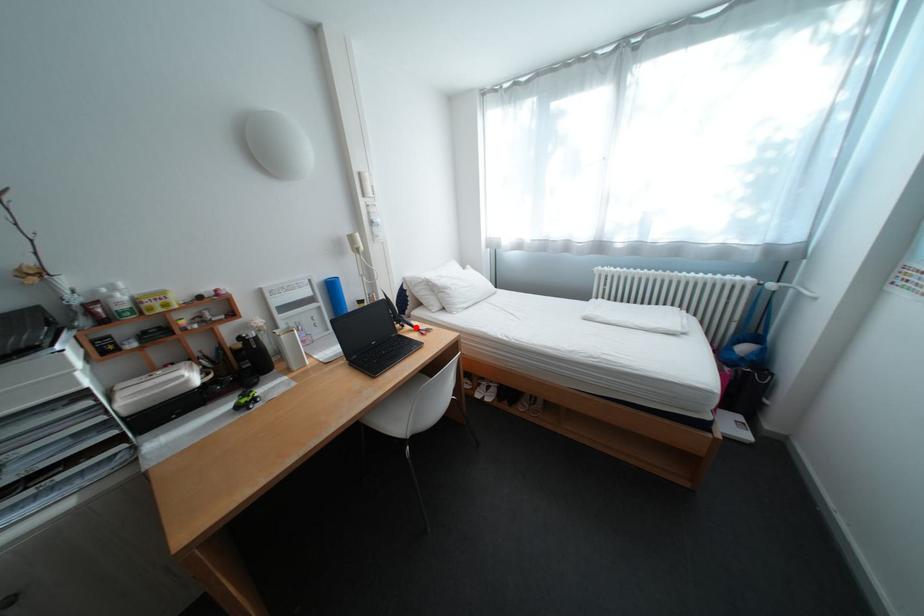
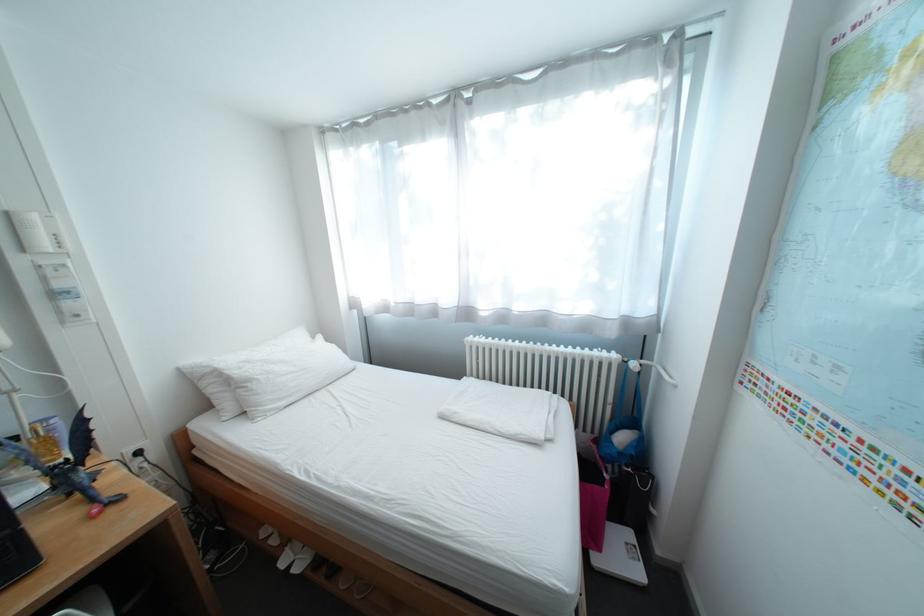
Find the pixel in the second image that matches the highlighted location in the first image.

(81, 495)